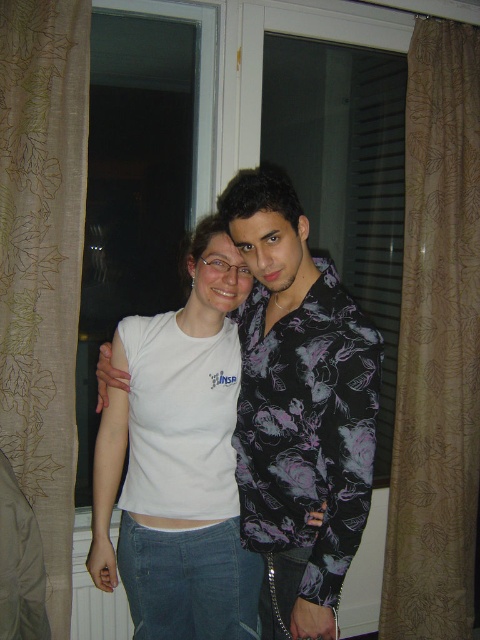
You are trying to decide which curtain to open first to let in more light. Based on their widths, which one should you choose between the brown textured curtain at right and the brown textured curtain at left?

The brown textured curtain at right is wider than the brown textured curtain at left, so opening the brown textured curtain at right first would allow more light in.